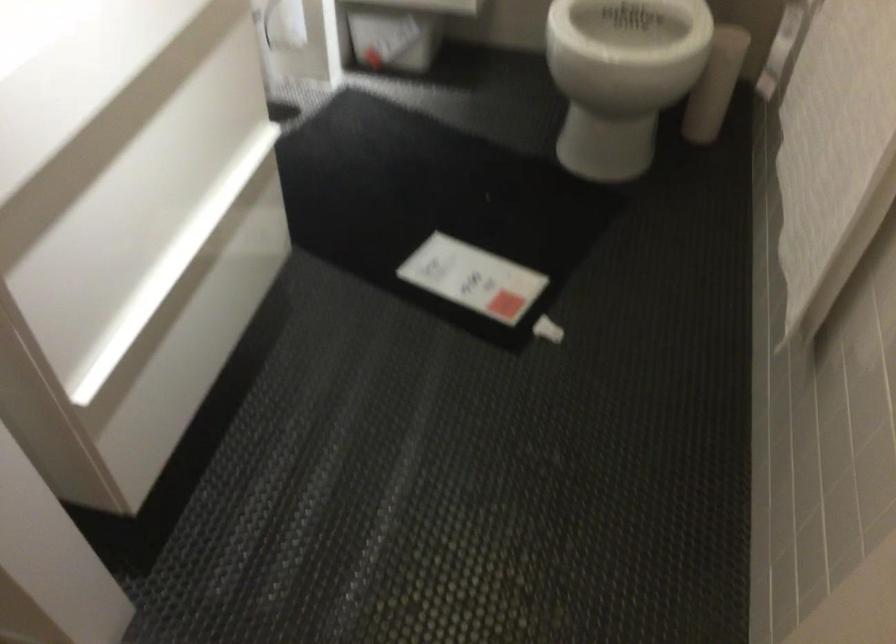
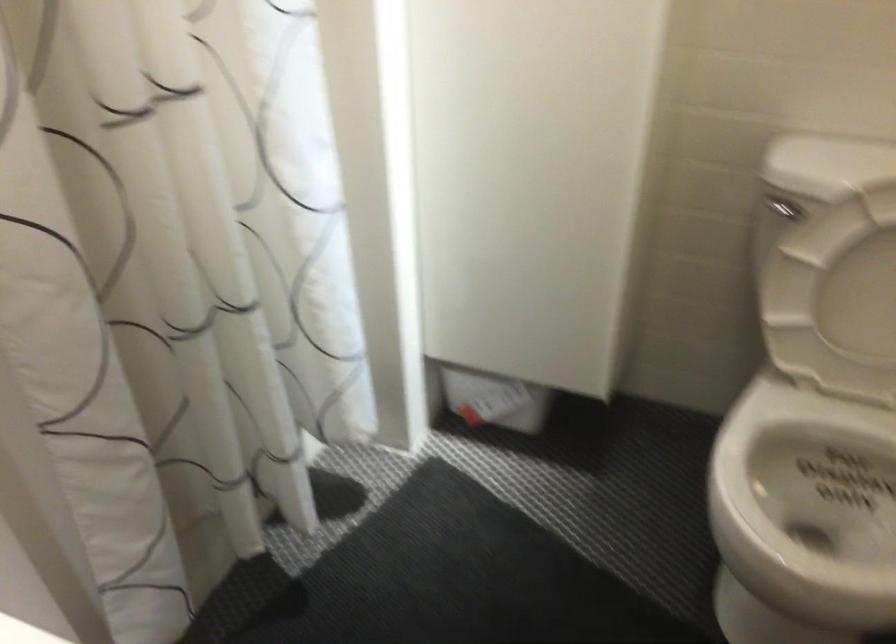
Question: Which direction would the cameraman need to move to produce the second image? Reply with the corresponding letter.

Choices:
 (A) Left
 (B) Right
 (C) Forward
 (D) Backward

Answer: (C)